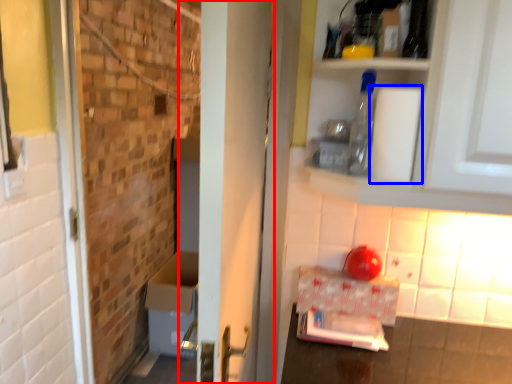
Question: Which object is closer to the camera taking this photo, door (highlighted by a red box) or toilet paper (highlighted by a blue box)?

Choices:
 (A) door
 (B) toilet paper

Answer: (A)